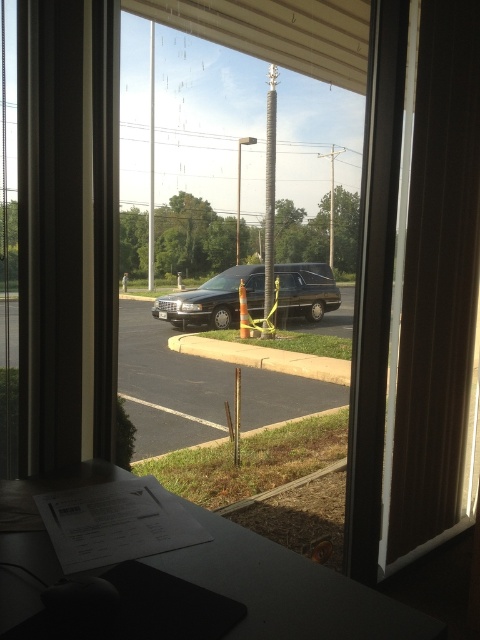
You are a delivery person standing at the entrance of the parking lot. You need to deliver a package to the driver of the black glossy car at center. The parking lot has a rule that you must stay at least 6 feet away from any vehicle. Can you safely approach the car to hand over the package without violating the rule?

The distance between you and the black glossy car at center is 25.59 feet, which is more than the required 6 feet. Therefore, you can safely approach the car to deliver the package without violating the parking lot rules.

You are a delivery person standing at the entrance of the parking lot. You need to park your van between the black glossy car at center and the black matte hearse at center. The van is 5.5 meters long. Can you fit your van between them?

The distance between the black glossy car at center and the black matte hearse at center is 5.28 meters. Since the van is 5.5 meters long, it is slightly longer than the available space. Therefore, the van cannot fit between them.